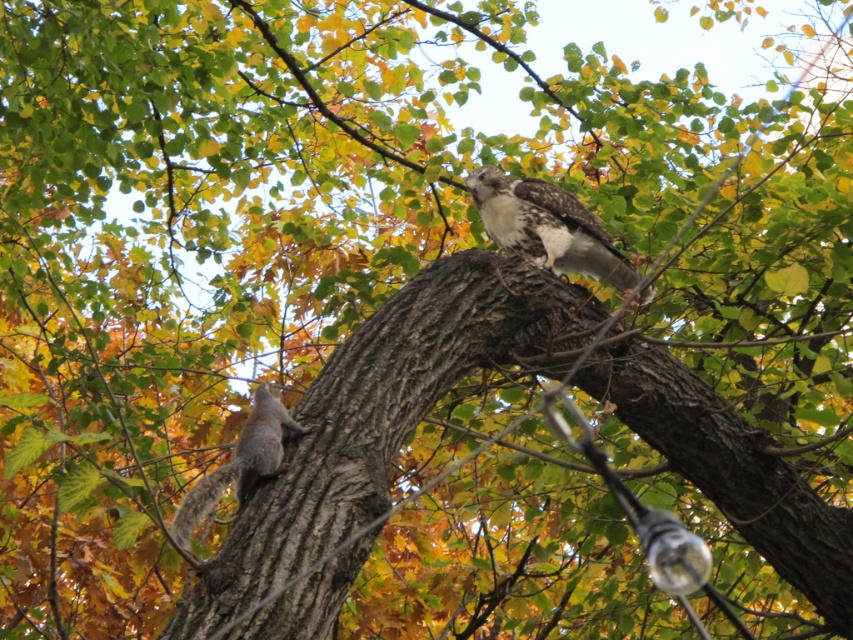
Question: Among these objects, which one is nearest to the camera?

Choices:
 (A) gray fur squirrel at lower left
 (B) brown speckled feathers at upper center

Answer: (A)

Question: Where is brown rough tree trunk at center located in relation to gray fur squirrel at lower left in the image?

Choices:
 (A) right
 (B) left

Answer: (A)

Question: Does brown rough tree trunk at center lie behind gray fur squirrel at lower left?

Choices:
 (A) yes
 (B) no

Answer: (B)

Question: Which object is positioned closest to the gray fur squirrel at lower left?

Choices:
 (A) brown rough tree trunk at center
 (B) brown speckled feathers at upper center

Answer: (A)

Question: Which point appears farthest from the camera in this image?

Choices:
 (A) (531, 296)
 (B) (567, 195)

Answer: (B)

Question: Is brown rough tree trunk at center further to the viewer compared to gray fur squirrel at lower left?

Choices:
 (A) no
 (B) yes

Answer: (A)